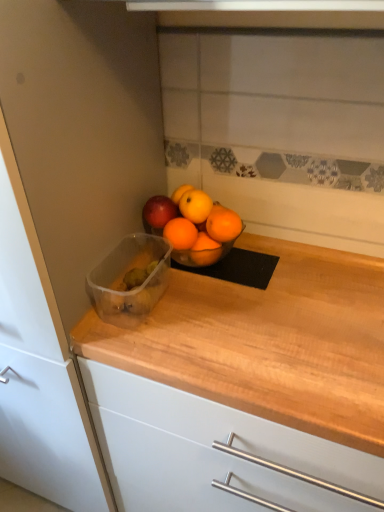
Question: Considering the positions of wooden countertop at left and wooden at center in the image, is wooden countertop at left bigger or smaller than wooden at center?

Choices:
 (A) small
 (B) big

Answer: (B)

Question: Choose the correct answer: Is wooden countertop at left inside wooden at center or outside it?

Choices:
 (A) outside
 (B) inside

Answer: (A)

Question: Which object is the closest to the transparent plastic container at center?

Choices:
 (A) wooden at center
 (B) orange matte/orange at center
 (C) wooden countertop at left

Answer: (B)

Question: Which object is the farthest from the orange matte/orange at center?

Choices:
 (A) wooden at center
 (B) wooden countertop at left
 (C) transparent plastic container at center

Answer: (A)